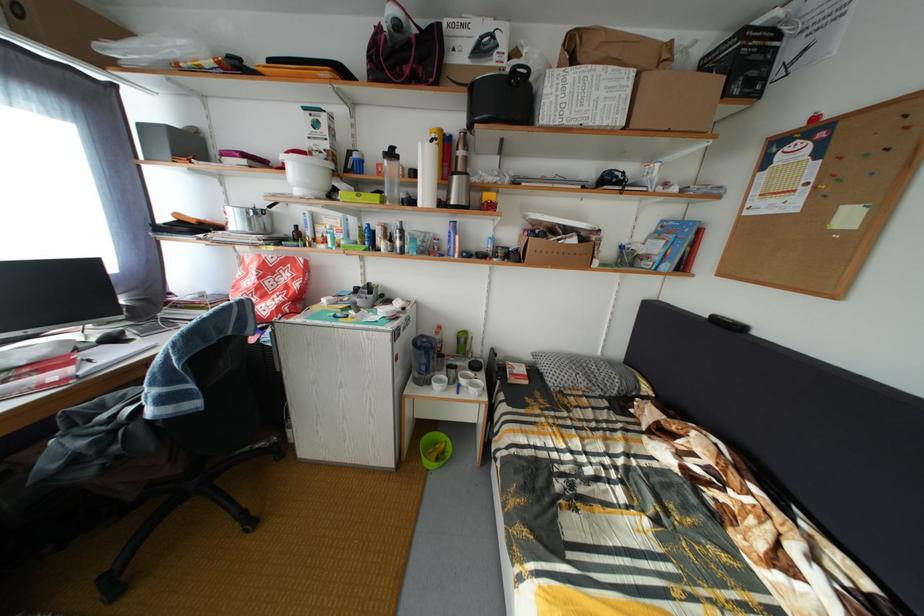
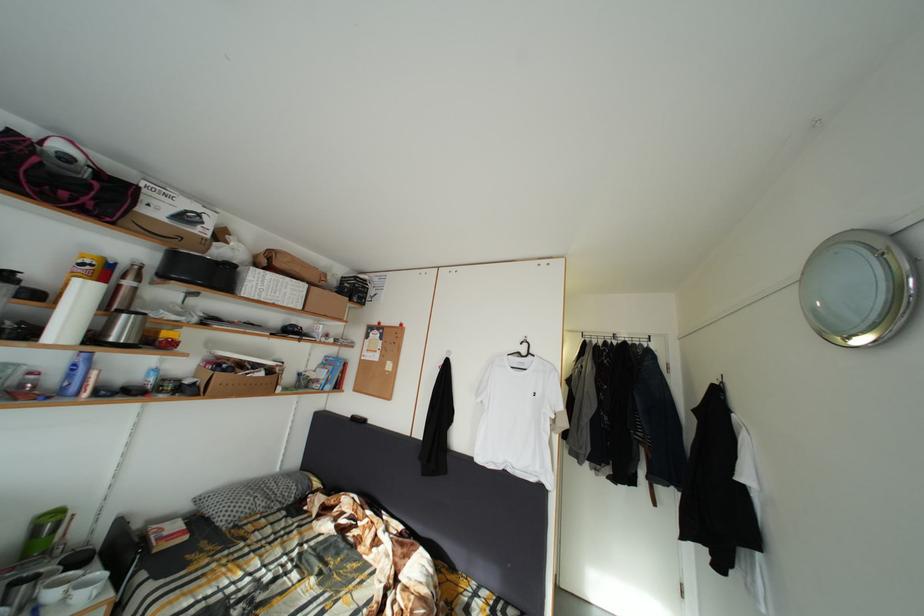
Where in the second image is the point corresponding to [467,346] from the first image?

(44, 537)